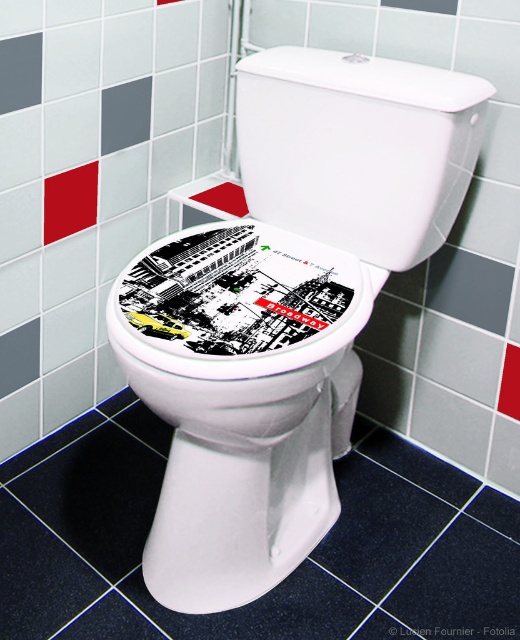
Is white glossy toilet bowl at center to the left of black glossy sticker at center from the viewer's perspective?

No, white glossy toilet bowl at center is not to the left of black glossy sticker at center.

Based on the photo, can you confirm if white glossy toilet bowl at center is positioned to the right of black glossy sticker at center?

Correct, you'll find white glossy toilet bowl at center to the right of black glossy sticker at center.

The width and height of the screenshot is (520, 640). Describe the element at coordinates (283, 307) in the screenshot. I see `white glossy toilet bowl at center` at that location.

Find the location of a particular element. The width and height of the screenshot is (520, 640). white glossy toilet bowl at center is located at coordinates [x=283, y=307].

Can you confirm if black glossy sticker at center is shorter than white glossy toilet lid at upper center?

No.

Between black glossy sticker at center and white glossy toilet lid at upper center, which one appears on the left side from the viewer's perspective?

black glossy sticker at center

The image size is (520, 640). What are the coordinates of `black glossy sticker at center` in the screenshot? It's located at (237, 301).

Does point (378, 168) lie behind point (253, 54)?

No, (378, 168) is closer to viewer.

Does white glossy toilet bowl at center have a greater height compared to white glossy toilet lid at upper center?

Yes.

Between point (123, 323) and point (487, 99), which one is positioned behind?

Point (487, 99)

In order to click on white glossy toilet bowl at center in this screenshot , I will do `click(283, 307)`.